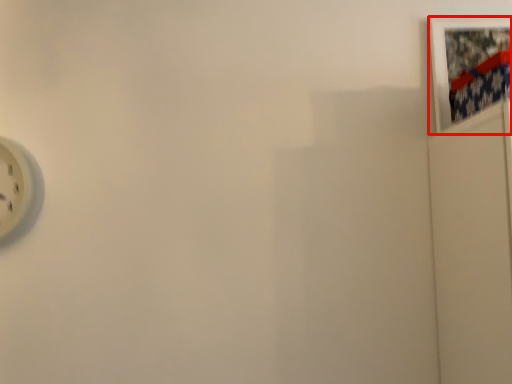
Question: From the image's perspective, where is picture frame (annotated by the red box) located relative to wall clock?

Choices:
 (A) below
 (B) above

Answer: (B)